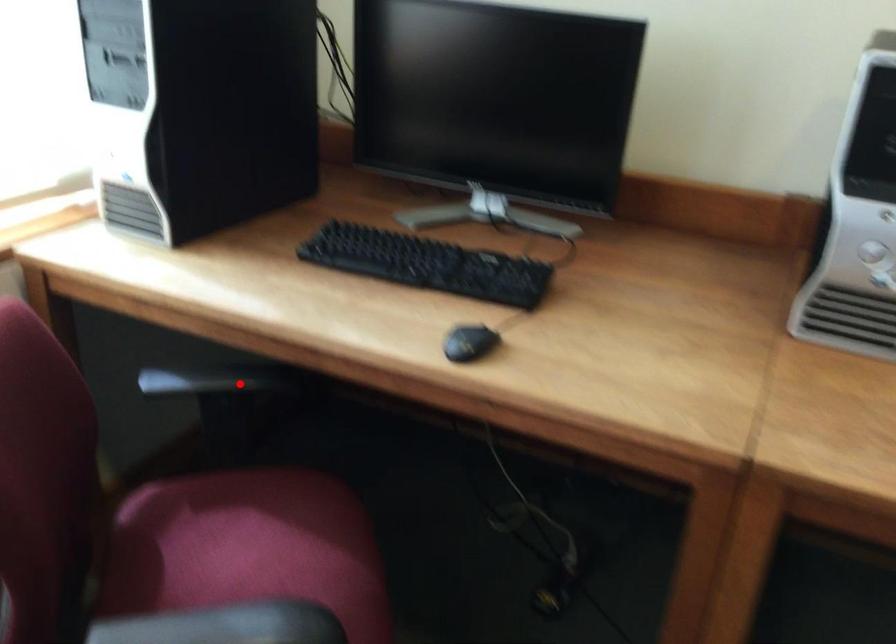
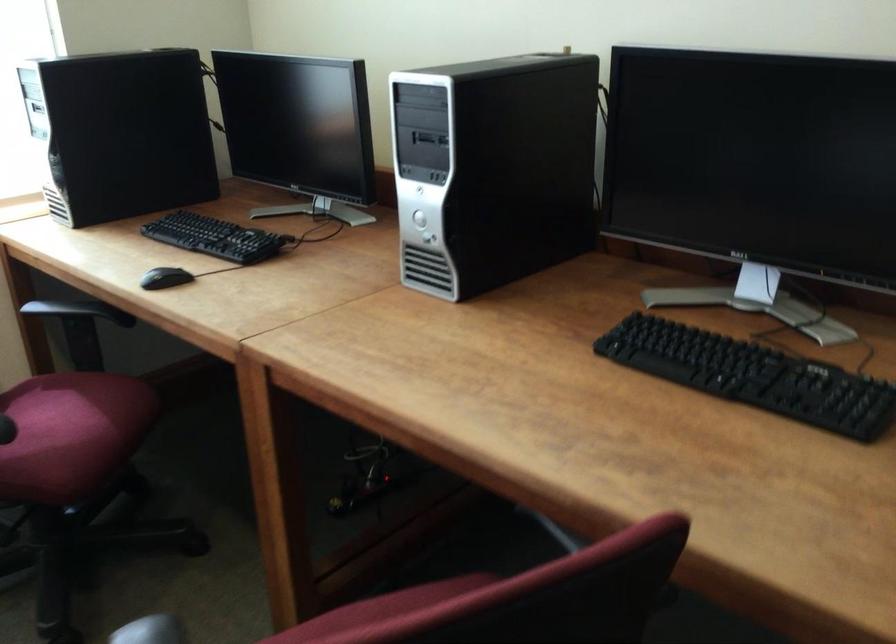
Question: I am providing you with two images of the same scene from different viewpoints. In image1, a red point is highlighted. Considering the same 3D point in image2, which of the following is correct?

Choices:
 (A) It is closer
 (B) It is farther

Answer: (B)